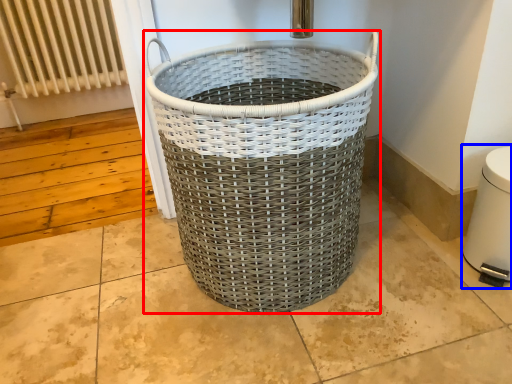
Question: Among these objects, which one is nearest to the camera, waste container (highlighted by a red box) or water heater (highlighted by a blue box)?

Choices:
 (A) waste container
 (B) water heater

Answer: (A)